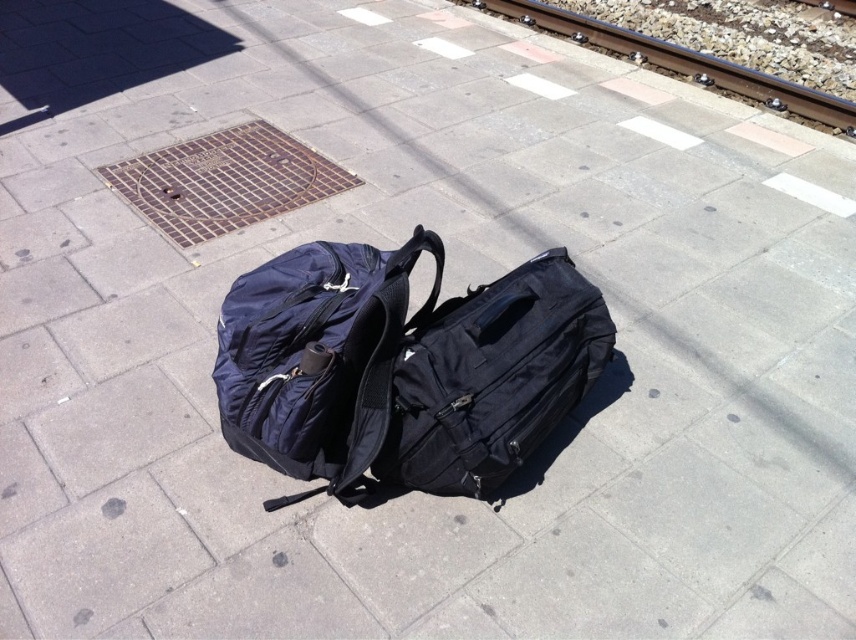
Can you confirm if navy blue fabric backpack at center is bigger than black fabric backpack at center?

Indeed, navy blue fabric backpack at center has a larger size compared to black fabric backpack at center.

Locate an element on the screen. The width and height of the screenshot is (856, 640). navy blue fabric backpack at center is located at coordinates (317, 358).

Identify the location of navy blue fabric backpack at center. This screenshot has width=856, height=640. (317, 358).

Does navy blue fabric backpack at center appear on the left side of metal at upper right?

Yes, navy blue fabric backpack at center is to the left of metal at upper right.

You are a GUI agent. You are given a task and a screenshot of the screen. Output one action in this format:
    pyautogui.click(x=<x>, y=<y>)
    Task: Click on the navy blue fabric backpack at center
    
    Given the screenshot: What is the action you would take?
    317,358

At what (x,y) coordinates should I click in order to perform the action: click on navy blue fabric backpack at center. Please return your answer as a coordinate pair (x, y). The width and height of the screenshot is (856, 640). Looking at the image, I should click on (317, 358).

Does black fabric backpack at center have a greater height compared to metal at upper right?

No, black fabric backpack at center is not taller than metal at upper right.

Who is more forward, (426,355) or (764,77)?

Point (426,355) is in front.

Is point (435, 428) positioned after point (516, 17)?

That is False.

You are a GUI agent. You are given a task and a screenshot of the screen. Output one action in this format:
    pyautogui.click(x=<x>, y=<y>)
    Task: Click on the black fabric backpack at center
    The width and height of the screenshot is (856, 640).
    Given the screenshot: What is the action you would take?
    pyautogui.click(x=492, y=376)